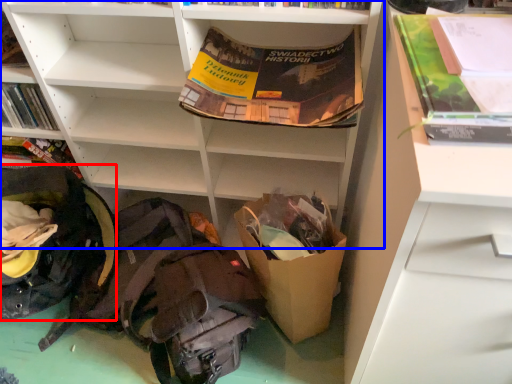
Question: Which point is closer to the camera, backpack (highlighted by a red box) or shelf (highlighted by a blue box)?

Choices:
 (A) backpack
 (B) shelf

Answer: (B)